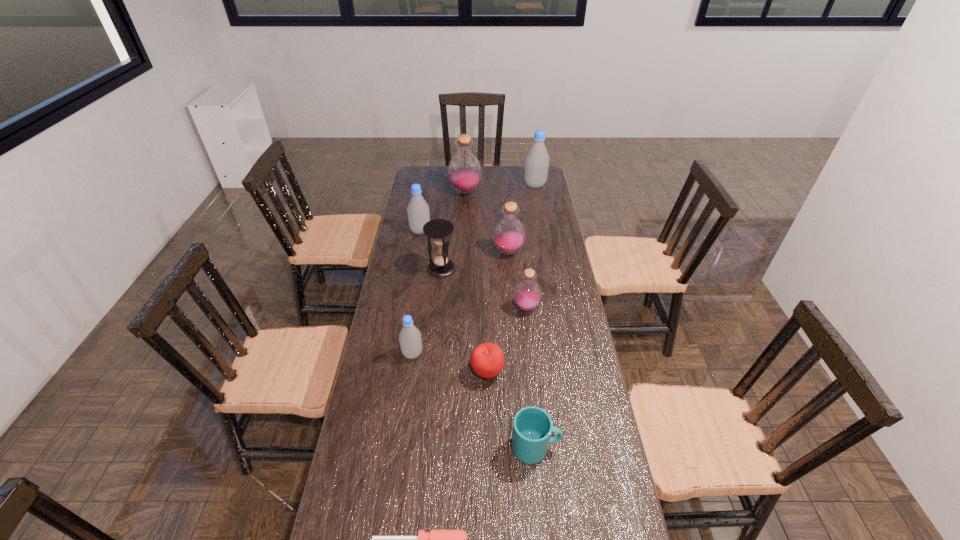
Locate an element on the screen. The height and width of the screenshot is (540, 960). the fifth closest bottle to the third bottle from left to right is located at coordinates (410, 340).

Select which purple bottle is the third closest to the red apple. Please provide its 2D coordinates. Your answer should be formatted as a tuple, i.e. [(x, y)], where the tuple contains the x and y coordinates of a point satisfying the conditions above.

[(464, 170)]

Identify which purple bottle is the closest to the leftmost purple bottle. Please provide its 2D coordinates. Your answer should be formatted as a tuple, i.e. [(x, y)], where the tuple contains the x and y coordinates of a point satisfying the conditions above.

[(509, 234)]

Choose which gray bottle is the nearest neighbor to the red apple. Please provide its 2D coordinates. Your answer should be formatted as a tuple, i.e. [(x, y)], where the tuple contains the x and y coordinates of a point satisfying the conditions above.

[(410, 340)]

Identify the location of the second closest gray bottle to the third farthest bottle. (410, 340).